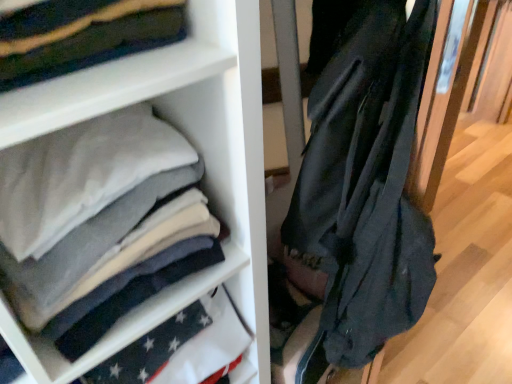
Question: From a real-world perspective, is white fabric at center physically located above or below black matte jacket at right?

Choices:
 (A) above
 (B) below

Answer: (A)

Question: Is point (158, 302) positioned closer to the camera than point (358, 304)?

Choices:
 (A) farther
 (B) closer

Answer: (B)

Question: From their relative heights in the image, would you say white fabric at center is taller or shorter than black matte jacket at right?

Choices:
 (A) short
 (B) tall

Answer: (A)

Question: From their relative heights in the image, would you say black matte jacket at right is taller or shorter than white fabric at center?

Choices:
 (A) tall
 (B) short

Answer: (A)

Question: Is black matte jacket at right bigger or smaller than white fabric at center?

Choices:
 (A) big
 (B) small

Answer: (A)

Question: Would you say black matte jacket at right is to the left or to the right of white fabric at center in the picture?

Choices:
 (A) right
 (B) left

Answer: (A)

Question: Is black matte jacket at right in front of or behind white fabric at center in the image?

Choices:
 (A) behind
 (B) front

Answer: (B)